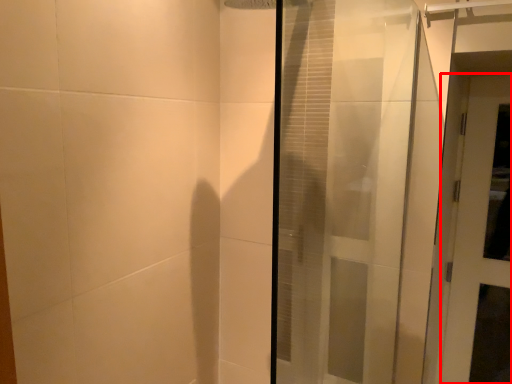
Question: Where is door (annotated by the red box) located in relation to door in the image?

Choices:
 (A) left
 (B) right

Answer: (B)